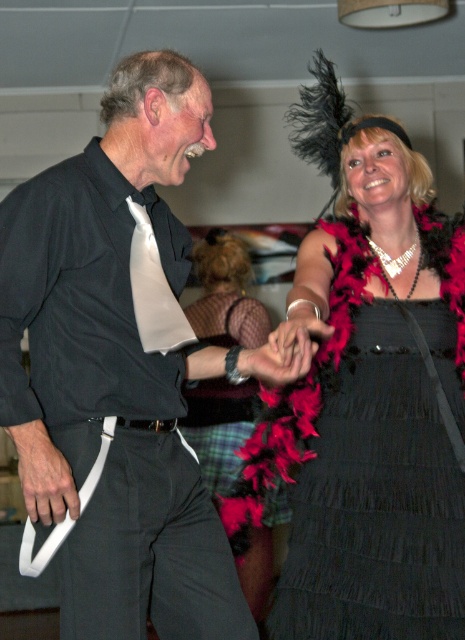
Does white silk tie at left have a greater height compared to black leather belt at center?

Indeed, white silk tie at left has a greater height compared to black leather belt at center.

Which is more to the right, white silk tie at left or black leather belt at center?

white silk tie at left

Does point (139, 241) come farther from viewer compared to point (159, 426)?

Yes, point (139, 241) is behind point (159, 426).

This screenshot has width=465, height=640. In order to click on white silk tie at left in this screenshot , I will do `click(153, 291)`.

Which is more to the right, matte black shirt at center or black satin dress at center?

From the viewer's perspective, black satin dress at center appears more on the right side.

Which is behind, point (74, 388) or point (437, 573)?

Positioned behind is point (437, 573).

The height and width of the screenshot is (640, 465). I want to click on matte black shirt at center, so (x=105, y=285).

Is point (111, 372) positioned behind point (166, 429)?

No, (111, 372) is closer to viewer.

Is matte black shirt at center further to camera compared to black leather belt at center?

No, it is in front of black leather belt at center.

Identify the location of matte black shirt at center. (105, 285).

Locate an element on the screen. Image resolution: width=465 pixels, height=640 pixels. matte black shirt at center is located at coordinates (105, 285).